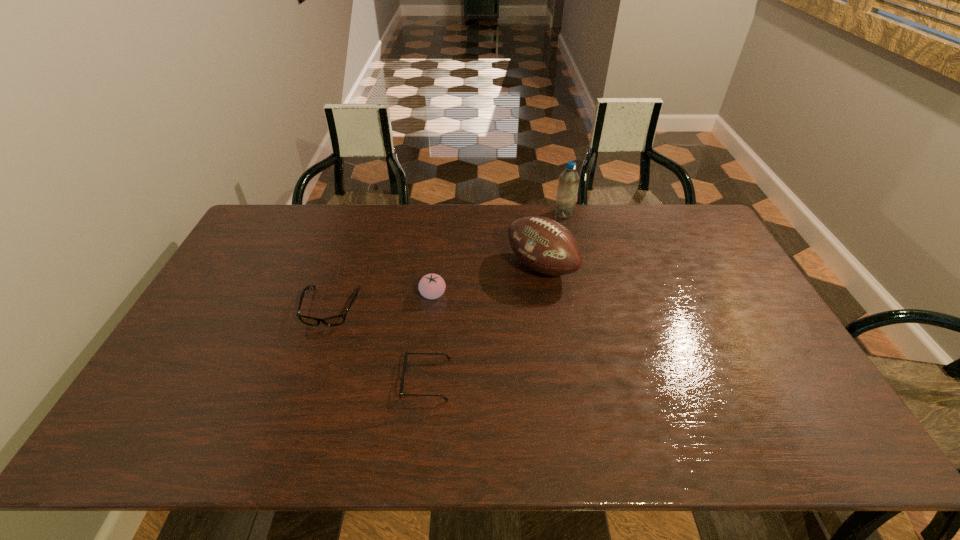
In order to click on object that is the third closest to the second tallest object in this screenshot , I will do `click(401, 394)`.

Locate an element on the screen. This screenshot has height=540, width=960. object identified as the second closest to the farthest object is located at coordinates (431, 286).

Where is `vacant area in the image that satisfies the following two spatial constraints: 1. on the front-facing side of the fourth shortest object; 2. on the right side of the shorter spectacles`? The height and width of the screenshot is (540, 960). vacant area in the image that satisfies the following two spatial constraints: 1. on the front-facing side of the fourth shortest object; 2. on the right side of the shorter spectacles is located at coordinates (438, 267).

Image resolution: width=960 pixels, height=540 pixels. I want to click on free space that satisfies the following two spatial constraints: 1. on the back side of the fourth shortest object; 2. on the right side of the water bottle, so click(x=533, y=213).

Find the location of `free location that satisfies the following two spatial constraints: 1. on the front-facing side of the shortest object; 2. on the left side of the second tallest object`. free location that satisfies the following two spatial constraints: 1. on the front-facing side of the shortest object; 2. on the left side of the second tallest object is located at coordinates (438, 267).

Locate an element on the screen. free spot that satisfies the following two spatial constraints: 1. on the front side of the third tallest object; 2. on the front-facing side of the nearest object is located at coordinates (423, 379).

The width and height of the screenshot is (960, 540). Identify the location of free spot that satisfies the following two spatial constraints: 1. on the back side of the water bottle; 2. on the right side of the football (American). (533, 213).

Locate an element on the screen. The image size is (960, 540). free space that satisfies the following two spatial constraints: 1. on the front-facing side of the shortest object; 2. on the left side of the football (American) is located at coordinates (438, 267).